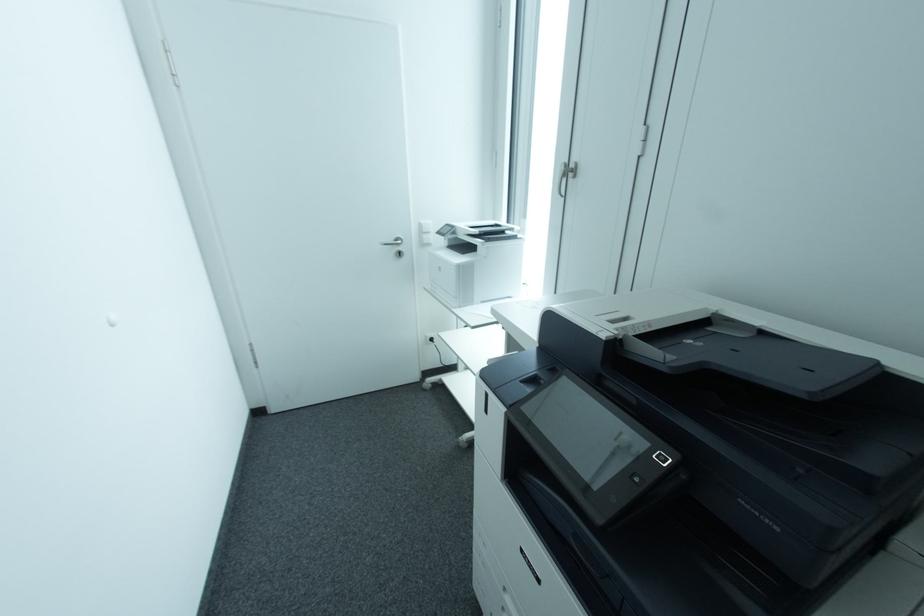
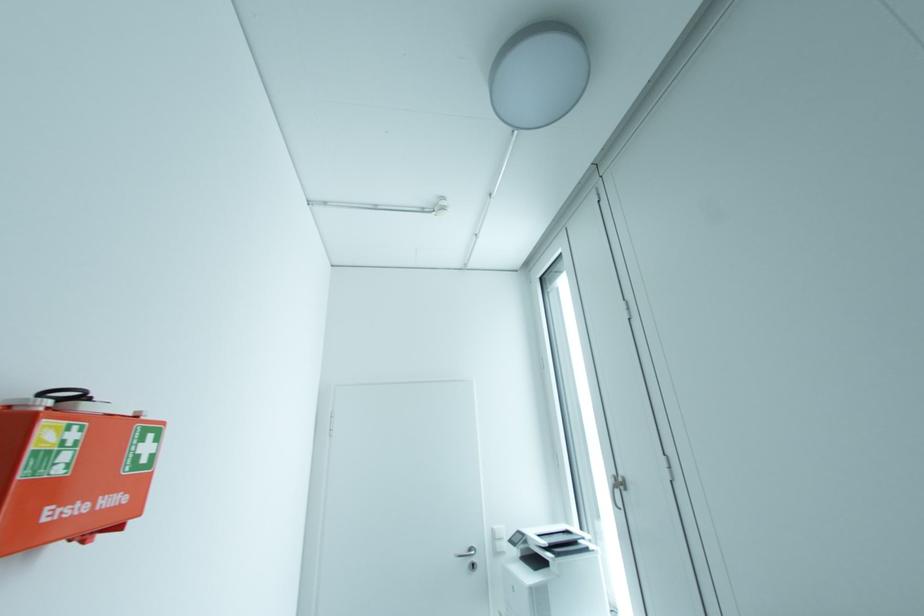
Question: The first image is from the beginning of the video and the second image is from the end. How did the camera likely rotate when shooting the video?

Choices:
 (A) Left
 (B) Right
 (C) Up
 (D) Down

Answer: (C)